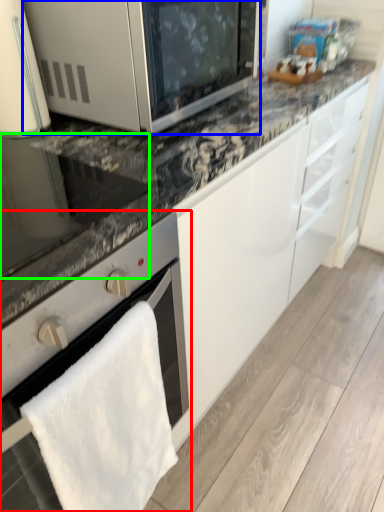
Question: Based on their relative distances, which object is nearer to oven (highlighted by a red box)? Choose from microwave oven (highlighted by a blue box) and appliance (highlighted by a green box).

Choices:
 (A) microwave oven
 (B) appliance

Answer: (B)